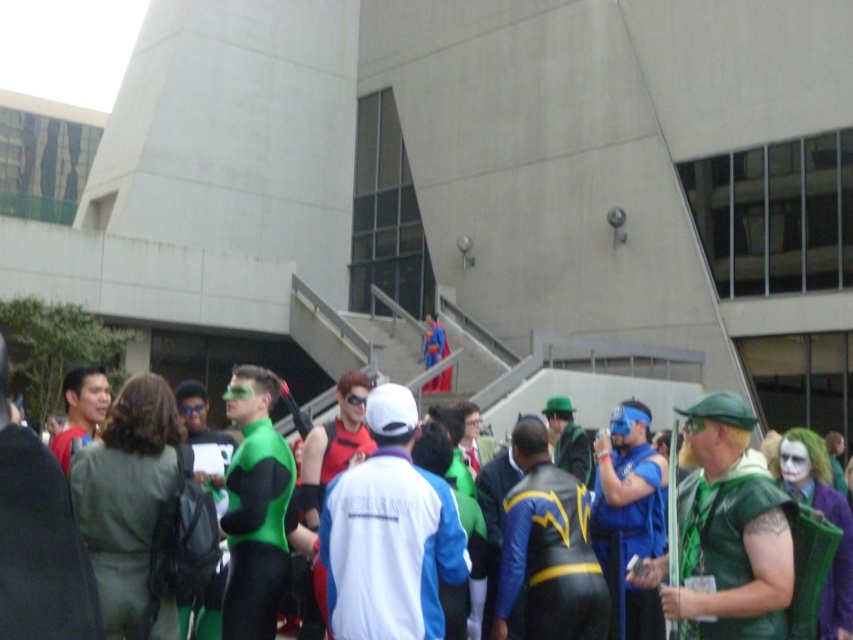
You are a photographer at the event and want to capture both the green spandex suit at center and the shiny blue costume at center in a single shot. Which costume should you focus on first to ensure both are in frame?

You should focus on the green spandex suit at center first because it is closer to the viewer than the shiny blue costume at center, ensuring both will be in frame when properly adjusted.